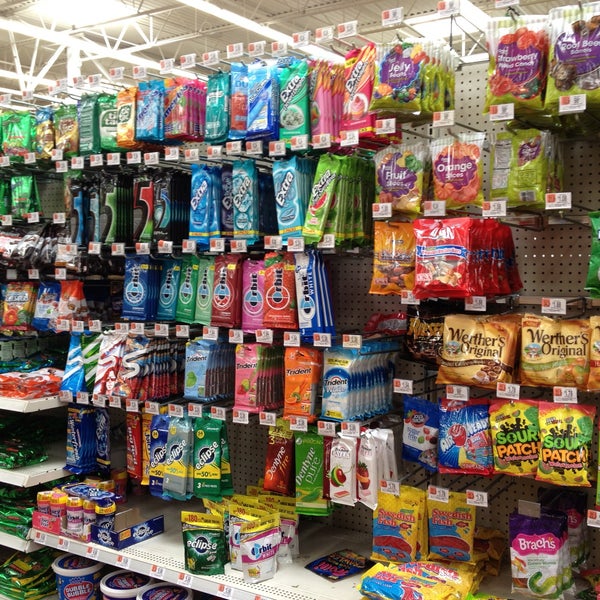
The width and height of the screenshot is (600, 600). Identify the location of box. (135, 530).